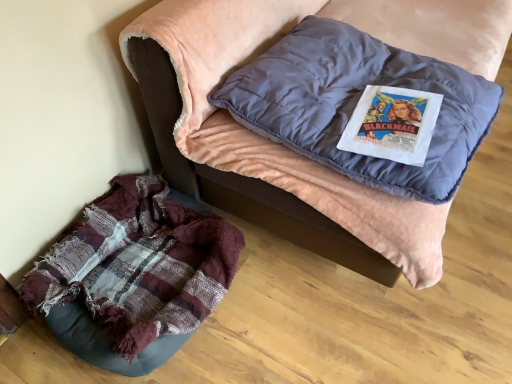
Question: Is point (229, 150) closer or farther from the camera than point (346, 34)?

Choices:
 (A) closer
 (B) farther

Answer: (A)

Question: From a real-world perspective, is plaid fabric cushion at lower left physically located above or below matte blue pillow at upper center?

Choices:
 (A) below
 (B) above

Answer: (A)

Question: Which of these objects is positioned farthest from the matte blue pillow at upper center?

Choices:
 (A) worn fabric bean bag at lower left
 (B) plaid fabric cushion at lower left

Answer: (A)

Question: Estimate the real-world distances between objects in this image. Which object is closer to the plaid fabric cushion at lower left?

Choices:
 (A) worn fabric bean bag at lower left
 (B) matte blue pillow at upper center

Answer: (B)